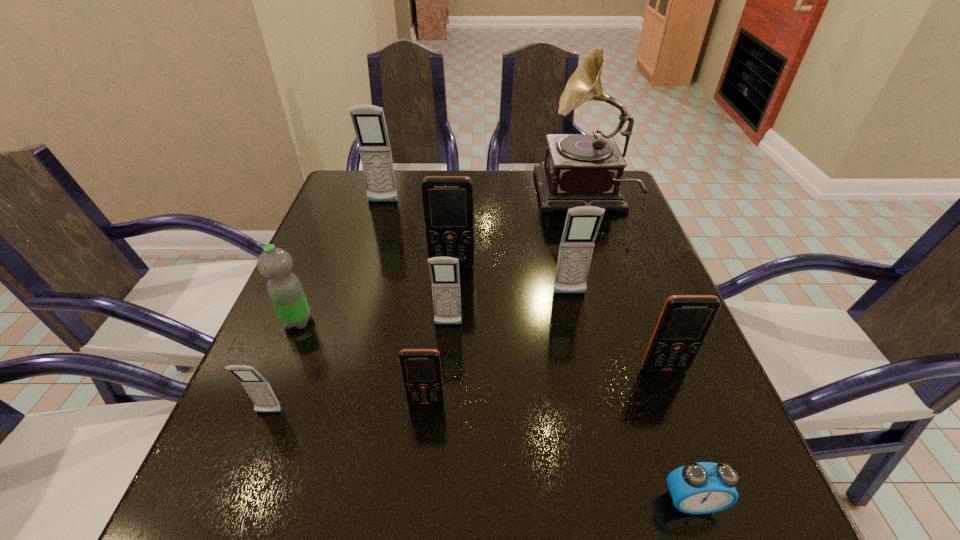
Locate an element on the screen. This screenshot has height=540, width=960. the second gray cellular telephone from right to left is located at coordinates (444, 271).

Locate an element on the screen. the rightmost orange cellular telephone is located at coordinates (685, 320).

This screenshot has width=960, height=540. I want to click on the second biggest orange cellular telephone, so click(x=685, y=320).

Locate an element on the screen. the eighth farthest object is located at coordinates (421, 368).

At what (x,y) coordinates should I click in order to perform the action: click on the smallest orange cellular telephone. Please return your answer as a coordinate pair (x, y). Looking at the image, I should click on (421, 368).

The image size is (960, 540). Identify the location of the second nearest object. (259, 390).

Locate an element on the screen. The width and height of the screenshot is (960, 540). the nearest cellular telephone is located at coordinates (259, 390).

Identify the location of alarm clock. tap(705, 487).

This screenshot has height=540, width=960. Find the location of `the shortest object`. the shortest object is located at coordinates (705, 487).

You are a GUI agent. You are given a task and a screenshot of the screen. Output one action in this format:
    pyautogui.click(x=<x>, y=<y>)
    Task: Click on the free region located on the horn of the golden record player
    This screenshot has height=540, width=960.
    Given the screenshot: What is the action you would take?
    pyautogui.click(x=458, y=195)